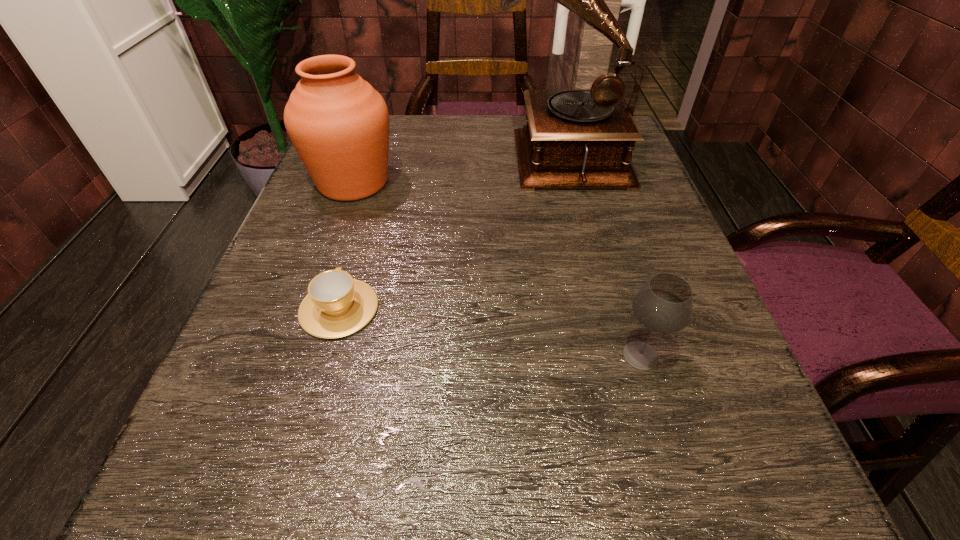
Find the location of a particular element. This screenshot has height=540, width=960. blank area in the image that satisfies the following two spatial constraints: 1. on the front side of the wineglass; 2. on the left side of the urn is located at coordinates (293, 355).

At what (x,y) coordinates should I click in order to perform the action: click on blank space that satisfies the following two spatial constraints: 1. on the horn of the record player; 2. on the front side of the urn. Please return your answer as a coordinate pair (x, y). The image size is (960, 540). Looking at the image, I should click on (567, 183).

What are the coordinates of `vacant space that satisfies the following two spatial constraints: 1. on the horn of the third tallest object; 2. on the right side of the tallest object` in the screenshot? It's located at (609, 355).